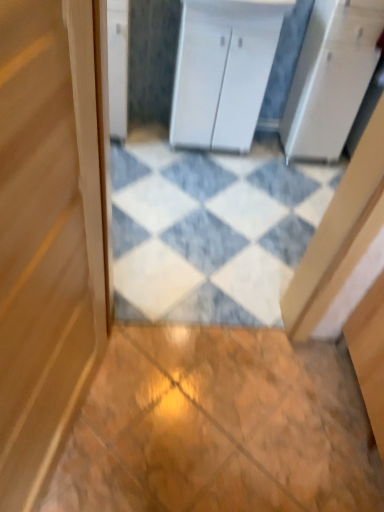
What do you see at coordinates (117, 66) in the screenshot? I see `white glossy cabinet at upper left, the second cabinetry viewed from the right` at bounding box center [117, 66].

Find the location of a particular element. The image size is (384, 512). white matte cabinet at center, the first cabinetry positioned from the right is located at coordinates (223, 70).

Find the location of a particular element. Image resolution: width=384 pixels, height=512 pixels. white glossy counter top at upper center is located at coordinates (242, 7).

Where is `wooden door at center`? Image resolution: width=384 pixels, height=512 pixels. wooden door at center is located at coordinates (47, 234).

This screenshot has height=512, width=384. I want to click on wooden tile at center, the 1th tile when ordered from bottom to top, so click(219, 426).

Is white glossy cabinet at upper left, arranged as the first cabinetry when viewed from the left, situated inside wooden door at center or outside?

white glossy cabinet at upper left, arranged as the first cabinetry when viewed from the left, is outside wooden door at center.

From the image's perspective, is white glossy cabinet at upper left, the second cabinetry viewed from the right, positioned above or below wooden door at center?

Based on their image positions, white glossy cabinet at upper left, the second cabinetry viewed from the right, is located above wooden door at center.

Considering the positions of point (125, 14) and point (38, 127), is point (125, 14) closer or farther from the camera than point (38, 127)?

Point (125, 14) is positioned farther from the camera compared to point (38, 127).

Is white glossy cabinet at upper left, arranged as the first cabinetry when viewed from the left, facing towards wooden door at center?

Yes.

Where is `the 1st tile counting from the right side of the white glossy cabinet at upper left, arranged as the first cabinetry when viewed from the left`? The image size is (384, 512). the 1st tile counting from the right side of the white glossy cabinet at upper left, arranged as the first cabinetry when viewed from the left is located at coordinates (219, 426).

Between white glossy cabinet at upper left, arranged as the first cabinetry when viewed from the left, and wooden tile at center, the 1th tile when ordered from bottom to top, which one appears on the right side from the viewer's perspective?

wooden tile at center, the 1th tile when ordered from bottom to top.

Considering the sizes of objects white glossy cabinet at upper left, the second cabinetry viewed from the right, and wooden tile at center, arranged as the 2th tile when viewed from the back, in the image provided, who is taller, white glossy cabinet at upper left, the second cabinetry viewed from the right, or wooden tile at center, arranged as the 2th tile when viewed from the back,?

With more height is white glossy cabinet at upper left, the second cabinetry viewed from the right.

How different are the orientations of white glossy cabinet at upper left, the second cabinetry viewed from the right, and wooden tile at center, the 1th tile when ordered from bottom to top, in degrees?

They differ by 90.1 degrees in their facing directions.

Is wooden door at center taller or shorter than white glossy cabinet at upper left, the second cabinetry viewed from the right?

Considering their sizes, wooden door at center has more height than white glossy cabinet at upper left, the second cabinetry viewed from the right.

Which of these two, wooden door at center or white glossy cabinet at upper left, the second cabinetry viewed from the right, is bigger?

wooden door at center is bigger.

This screenshot has height=512, width=384. Find the location of `cabinetry lying on the left of wooden door at center`. cabinetry lying on the left of wooden door at center is located at coordinates (117, 66).

From the image's perspective, is white glossy counter top at upper center over white marble tile at center, marked as the 1th tile in a back-to-front arrangement?

Correct, white glossy counter top at upper center appears higher than white marble tile at center, marked as the 1th tile in a back-to-front arrangement, in the image.

Considering the relative positions of white glossy counter top at upper center and white marble tile at center, which appears as the 2th tile when viewed from the front, in the image provided, is white glossy counter top at upper center to the right of white marble tile at center, which appears as the 2th tile when viewed from the front, from the viewer's perspective?

No, white glossy counter top at upper center is not to the right of white marble tile at center, which appears as the 2th tile when viewed from the front.

From a real-world perspective, which is physically below, white glossy counter top at upper center or white marble tile at center, which appears as the 2th tile when viewed from the front?

In real-world perspective, white marble tile at center, which appears as the 2th tile when viewed from the front, is lower.

Which is behind, white glossy counter top at upper center or white marble tile at center, which appears as the 2th tile when viewed from the front?

white glossy counter top at upper center is more distant.

Where is `cabinetry above the white matte cabinet at center, the first cabinetry positioned from the right (from the image's perspective)`? Image resolution: width=384 pixels, height=512 pixels. cabinetry above the white matte cabinet at center, the first cabinetry positioned from the right (from the image's perspective) is located at coordinates (117, 66).

Does point (230, 128) appear closer or farther from the camera than point (122, 0)?

Point (230, 128) appears to be farther away from the viewer than point (122, 0).

Are white matte cabinet at center, the first cabinetry positioned from the right, and white glossy cabinet at upper left, the second cabinetry viewed from the right, far apart?

Actually, white matte cabinet at center, the first cabinetry positioned from the right, and white glossy cabinet at upper left, the second cabinetry viewed from the right, are a little close together.

In terms of size, does white matte cabinet at center, the first cabinetry positioned from the right, appear bigger or smaller than white glossy cabinet at upper left, the second cabinetry viewed from the right?

white matte cabinet at center, the first cabinetry positioned from the right, is bigger than white glossy cabinet at upper left, the second cabinetry viewed from the right.

From a real-world perspective, does white marble tile at center, arranged as the 1th tile when viewed from the top, sit lower than white glossy counter top at upper center?

Indeed, from a real-world perspective, white marble tile at center, arranged as the 1th tile when viewed from the top, is positioned beneath white glossy counter top at upper center.

From the picture: Is white marble tile at center, arranged as the 1th tile when viewed from the top, bigger than white glossy counter top at upper center?

Yes.

Which object is positioned more to the right, white marble tile at center, marked as the 1th tile in a back-to-front arrangement, or white glossy counter top at upper center?

Positioned to the right is white marble tile at center, marked as the 1th tile in a back-to-front arrangement.

Is point (121, 249) behind point (211, 14)?

No, (121, 249) is in front of (211, 14).

Based on the photo, from the image's perspective, who appears lower, white glossy counter top at upper center or white matte cabinet at center, the second cabinetry viewed from the left?

white matte cabinet at center, the second cabinetry viewed from the left, from the image's perspective.

I want to click on cabinetry that is the 1st one when counting leftward from the white glossy counter top at upper center, so click(223, 70).

Between white glossy counter top at upper center and white matte cabinet at center, the first cabinetry positioned from the right, which one appears on the left side from the viewer's perspective?

white matte cabinet at center, the first cabinetry positioned from the right, is more to the left.

Considering the points (217, 13) and (243, 42), which point is in front, point (217, 13) or point (243, 42)?

Positioned in front is point (217, 13).

Where is `door on the right of white glossy cabinet at upper left, arranged as the first cabinetry when viewed from the left`? This screenshot has width=384, height=512. door on the right of white glossy cabinet at upper left, arranged as the first cabinetry when viewed from the left is located at coordinates (47, 234).

At what (x,y) coordinates should I click in order to perform the action: click on cabinetry on the left of wooden tile at center, the second tile from the top. Please return your answer as a coordinate pair (x, y). The width and height of the screenshot is (384, 512). Looking at the image, I should click on (117, 66).

Considering their positions, is white matte cabinet at center, the second cabinetry viewed from the left, positioned closer to wooden tile at center, the first tile positioned from the front, than white glossy cabinet at upper left, the second cabinetry viewed from the right?

white matte cabinet at center, the second cabinetry viewed from the left.

When comparing their distances from white marble tile at center, marked as the 1th tile in a back-to-front arrangement, does wooden tile at center, the second tile from the top, or white glossy cabinet at upper left, arranged as the first cabinetry when viewed from the left, seem further?

white glossy cabinet at upper left, arranged as the first cabinetry when viewed from the left, is further to white marble tile at center, marked as the 1th tile in a back-to-front arrangement.

When comparing their distances from white marble tile at center, marked as the 1th tile in a back-to-front arrangement, does white matte cabinet at center, the second cabinetry viewed from the left, or wooden door at center seem further?

wooden door at center is positioned further to the anchor white marble tile at center, marked as the 1th tile in a back-to-front arrangement.

Considering their positions, is white glossy counter top at upper center positioned closer to wooden door at center than white marble tile at center, arranged as the 1th tile when viewed from the top?

Among the two, white marble tile at center, arranged as the 1th tile when viewed from the top, is located nearer to wooden door at center.

Which object lies further to the anchor point white glossy counter top at upper center, white matte cabinet at center, the first cabinetry positioned from the right, or white marble tile at center, marked as the 1th tile in a back-to-front arrangement?

The object further to white glossy counter top at upper center is white marble tile at center, marked as the 1th tile in a back-to-front arrangement.

Looking at this image, when comparing their distances from white glossy cabinet at upper left, arranged as the first cabinetry when viewed from the left, does wooden door at center or wooden tile at center, the second tile from the top, seem further?

Based on the image, wooden tile at center, the second tile from the top, appears to be further to white glossy cabinet at upper left, arranged as the first cabinetry when viewed from the left.

Looking at the image, which one is located closer to white glossy counter top at upper center, white glossy cabinet at upper left, arranged as the first cabinetry when viewed from the left, or white marble tile at center, which appears as the 2th tile when viewed from the front?

white glossy cabinet at upper left, arranged as the first cabinetry when viewed from the left, is closer to white glossy counter top at upper center.

From the image, which object appears to be farther from wooden tile at center, the second tile from the top, white glossy cabinet at upper left, arranged as the first cabinetry when viewed from the left, or wooden door at center?

white glossy cabinet at upper left, arranged as the first cabinetry when viewed from the left, is further to wooden tile at center, the second tile from the top.

Find the location of `cabinetry between white glossy cabinet at upper left, arranged as the first cabinetry when viewed from the left, and white glossy counter top at upper center from left to right`. cabinetry between white glossy cabinet at upper left, arranged as the first cabinetry when viewed from the left, and white glossy counter top at upper center from left to right is located at coordinates (223, 70).

What are the coordinates of `tile between white glossy counter top at upper center and wooden tile at center, arranged as the 2th tile when viewed from the back, vertically` in the screenshot? It's located at (210, 232).

Identify the location of tile that lies between white matte cabinet at center, the first cabinetry positioned from the right, and wooden tile at center, the first tile positioned from the front, from top to bottom. The image size is (384, 512). (210, 232).

Locate an element on the screen. cabinetry between wooden door at center and white matte cabinet at center, the second cabinetry viewed from the left, from front to back is located at coordinates (117, 66).